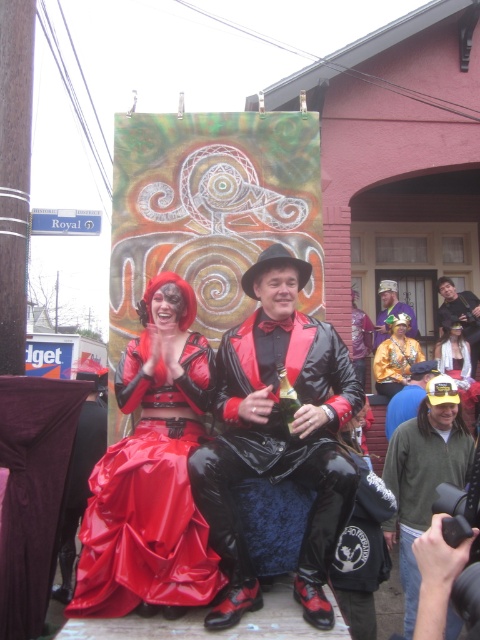
Question: Which point is closer to the camera taking this photo?

Choices:
 (A) (389, 401)
 (B) (311, 518)

Answer: (B)

Question: Which point is closer to the camera taking this photo?

Choices:
 (A) (156, 582)
 (B) (415, 410)
 (C) (217, 513)

Answer: (A)

Question: Can you confirm if glossy leather suit at center is positioned above green fleece jacket at lower right?

Choices:
 (A) yes
 (B) no

Answer: (A)

Question: Does glossy leather suit at center appear over green fleece jacket at lower right?

Choices:
 (A) yes
 (B) no

Answer: (A)

Question: Is glossy leather suit at center thinner than glossy vinyl dress at center?

Choices:
 (A) no
 (B) yes

Answer: (B)

Question: Among these points, which one is farthest from the camera?

Choices:
 (A) (148, 300)
 (B) (383, 326)

Answer: (B)